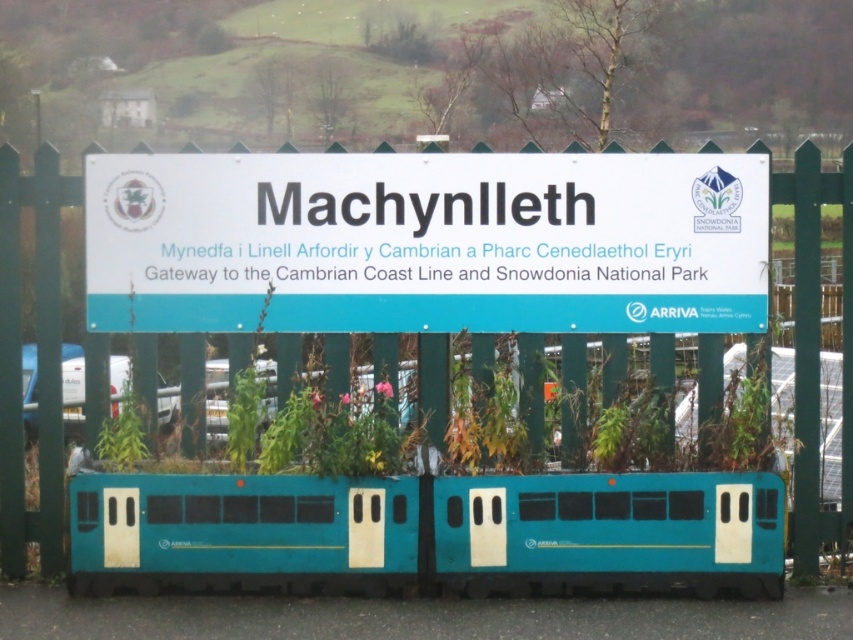
Question: Is white plastic sign at center further to the viewer compared to teal matte train at center?

Choices:
 (A) no
 (B) yes

Answer: (B)

Question: Is white plastic sign at center bigger than green wooden fence at center?

Choices:
 (A) yes
 (B) no

Answer: (B)

Question: From the image, what is the correct spatial relationship of teal matte train at center in relation to green wooden fence at center?

Choices:
 (A) left
 (B) right

Answer: (B)

Question: Which of the following is the farthest from the observer?

Choices:
 (A) teal matte train at center
 (B) green wooden fence at center

Answer: (B)

Question: Which point is closer to the camera?

Choices:
 (A) green wooden fence at center
 (B) teal matte train at center
 (C) white plastic sign at center

Answer: (B)

Question: Estimate the real-world distances between objects in this image. Which object is farther from the green wooden fence at center?

Choices:
 (A) white plastic sign at center
 (B) teal matte train at center

Answer: (B)